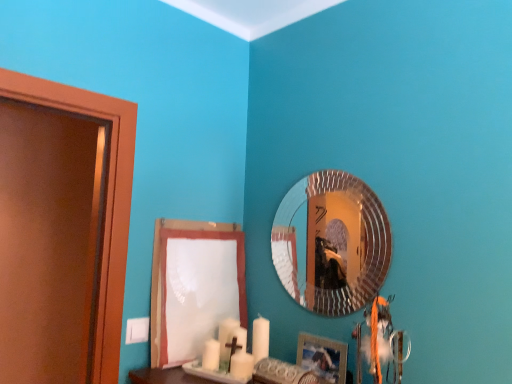
Describe the element at coordinates (332, 243) in the screenshot. I see `silver textured mirror at upper center` at that location.

Describe the element at coordinates (194, 286) in the screenshot. The image size is (512, 384). I see `white paper at lower center` at that location.

Describe the element at coordinates (323, 357) in the screenshot. I see `wooden picture frame at lower right` at that location.

Find the location of a particular element. This screenshot has width=512, height=384. silver textured mirror at upper center is located at coordinates (332, 243).

Between wooden picture frame at lower right and silver textured mirror at upper center, which one has more height?

silver textured mirror at upper center is taller.

Considering the sizes of wooden picture frame at lower right and silver textured mirror at upper center in the image, is wooden picture frame at lower right wider or thinner than silver textured mirror at upper center?

wooden picture frame at lower right is wider than silver textured mirror at upper center.

From the image's perspective, relative to silver textured mirror at upper center, is wooden picture frame at lower right above or below?

wooden picture frame at lower right is situated lower than silver textured mirror at upper center in the image.

From a real-world perspective, is wooden picture frame at lower right positioned under silver textured mirror at upper center based on gravity?

Indeed, from a real-world perspective, wooden picture frame at lower right is positioned beneath silver textured mirror at upper center.

Is point (369, 254) farther from camera compared to point (313, 352)?

That is True.

Can wooden picture frame at lower right be found inside silver textured mirror at upper center?

No, wooden picture frame at lower right is not a part of silver textured mirror at upper center.

Can you confirm if silver textured mirror at upper center is positioned to the right of wooden picture frame at lower right?

Yes.

In terms of height, does silver textured mirror at upper center look taller or shorter compared to wooden picture frame at lower right?

silver textured mirror at upper center is taller than wooden picture frame at lower right.

Is wooden picture frame at lower right turned away from white paper at lower center?

wooden picture frame at lower right is not turned away from white paper at lower center.

Considering the points (310, 360) and (153, 257), which point is behind, point (310, 360) or point (153, 257)?

The point (153, 257) is farther.

From the image's perspective, would you say wooden picture frame at lower right is positioned over white paper at lower center?

No, from the image's perspective, wooden picture frame at lower right is not on top of white paper at lower center.

Is silver textured mirror at upper center positioned in front of white paper at lower center?

Yes, it is.

Does point (379, 281) appear closer or farther from the camera than point (157, 327)?

Point (379, 281).

Considering the sizes of silver textured mirror at upper center and white paper at lower center in the image, is silver textured mirror at upper center bigger or smaller than white paper at lower center?

Clearly, silver textured mirror at upper center is smaller in size than white paper at lower center.

From a real-world perspective, is silver textured mirror at upper center physically below white paper at lower center?

No, from a real-world perspective, silver textured mirror at upper center is not below white paper at lower center.

In the scene shown: From a real-world perspective, which object stands above the other?

silver textured mirror at upper center is physically above.

Who is more distant, white paper at lower center or silver textured mirror at upper center?

white paper at lower center is behind.

Would you say white paper at lower center contains silver textured mirror at upper center?

No, white paper at lower center does not contain silver textured mirror at upper center.

Considering the relative sizes of white paper at lower center and silver textured mirror at upper center in the image provided, is white paper at lower center taller than silver textured mirror at upper center?

Yes, white paper at lower center is taller than silver textured mirror at upper center.

Find the location of `picture frame that is below the white paper at lower center (from the image's perspective)`. picture frame that is below the white paper at lower center (from the image's perspective) is located at coordinates (323, 357).

From the image's perspective, is white paper at lower center located above or below wooden picture frame at lower right?

white paper at lower center is above wooden picture frame at lower right.

Is white paper at lower center located outside wooden picture frame at lower right?

That's correct, white paper at lower center is outside of wooden picture frame at lower right.

Considering the relative positions of white paper at lower center and wooden picture frame at lower right in the image provided, is white paper at lower center to the right of wooden picture frame at lower right from the viewer's perspective?

Incorrect, white paper at lower center is not on the right side of wooden picture frame at lower right.

Identify the location of picture frame in front of the silver textured mirror at upper center. click(323, 357).

Find the location of a particular element. Image resolution: width=512 pixels, height=384 pixels. picture frame that appears on the left of silver textured mirror at upper center is located at coordinates (323, 357).

When comparing their distances from wooden picture frame at lower right, does silver textured mirror at upper center or white paper at lower center seem closer?

silver textured mirror at upper center lies closer to wooden picture frame at lower right than the other object.

Estimate the real-world distances between objects in this image. Which object is closer to white paper at lower center, wooden picture frame at lower right or silver textured mirror at upper center?

silver textured mirror at upper center lies closer to white paper at lower center than the other object.

From the image, which object appears to be farther from wooden picture frame at lower right, white paper at lower center or silver textured mirror at upper center?

Among the two, white paper at lower center is located further to wooden picture frame at lower right.

When comparing their distances from silver textured mirror at upper center, does wooden picture frame at lower right or white paper at lower center seem closer?

wooden picture frame at lower right lies closer to silver textured mirror at upper center than the other object.

Looking at the image, which one is located closer to silver textured mirror at upper center, white paper at lower center or wooden picture frame at lower right?

The object closer to silver textured mirror at upper center is wooden picture frame at lower right.

Which object lies further to the anchor point white paper at lower center, silver textured mirror at upper center or wooden picture frame at lower right?

Among the two, wooden picture frame at lower right is located further to white paper at lower center.

This screenshot has height=384, width=512. I want to click on picture frame between white paper at lower center and silver textured mirror at upper center in the horizontal direction, so click(323, 357).